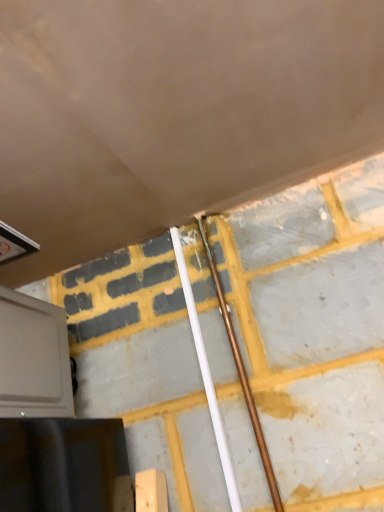
Question: Is white plastic pipe at center, the second beam when ordered from right to left, at the right side of copper metallic pipe at center, arranged as the second beam when viewed from the left?

Choices:
 (A) no
 (B) yes

Answer: (A)

Question: From a real-world perspective, is white plastic pipe at center, the 1th beam from the left, located higher than copper metallic pipe at center, arranged as the second beam when viewed from the left?

Choices:
 (A) yes
 (B) no

Answer: (A)

Question: Is white plastic pipe at center, the second beam when ordered from right to left, positioned beyond the bounds of copper metallic pipe at center, arranged as the second beam when viewed from the left?

Choices:
 (A) yes
 (B) no

Answer: (A)

Question: Does white plastic pipe at center, the second beam when ordered from right to left, appear on the left side of copper metallic pipe at center, arranged as the second beam when viewed from the left?

Choices:
 (A) no
 (B) yes

Answer: (B)

Question: Does white plastic pipe at center, the 1th beam from the left, have a lesser width compared to copper metallic pipe at center, arranged as the second beam when viewed from the left?

Choices:
 (A) no
 (B) yes

Answer: (B)

Question: Considering the positions of point (233, 343) and point (198, 356), is point (233, 343) closer or farther from the camera than point (198, 356)?

Choices:
 (A) farther
 (B) closer

Answer: (B)

Question: Is copper metallic pipe at center, arranged as the second beam when viewed from the left, inside or outside of white plastic pipe at center, the 1th beam from the left?

Choices:
 (A) inside
 (B) outside

Answer: (B)

Question: In the image, is copper metallic pipe at center, placed as the 1th beam when sorted from right to left, positioned in front of or behind white plastic pipe at center, the 1th beam from the left?

Choices:
 (A) front
 (B) behind

Answer: (A)

Question: From their relative heights in the image, would you say copper metallic pipe at center, arranged as the second beam when viewed from the left, is taller or shorter than white plastic pipe at center, the 1th beam from the left?

Choices:
 (A) tall
 (B) short

Answer: (A)

Question: Considering the positions of white plastic pipe at center, the second beam when ordered from right to left, and copper metallic pipe at center, placed as the 1th beam when sorted from right to left, in the image, is white plastic pipe at center, the second beam when ordered from right to left, taller or shorter than copper metallic pipe at center, placed as the 1th beam when sorted from right to left,?

Choices:
 (A) short
 (B) tall

Answer: (A)

Question: In terms of width, does white plastic pipe at center, the 1th beam from the left, look wider or thinner when compared to copper metallic pipe at center, arranged as the second beam when viewed from the left?

Choices:
 (A) thin
 (B) wide

Answer: (A)

Question: Which is correct: white plastic pipe at center, the second beam when ordered from right to left, is inside copper metallic pipe at center, placed as the 1th beam when sorted from right to left, or outside of it?

Choices:
 (A) outside
 (B) inside

Answer: (A)

Question: Visually, is white plastic pipe at center, the second beam when ordered from right to left, positioned to the left or to the right of copper metallic pipe at center, placed as the 1th beam when sorted from right to left?

Choices:
 (A) right
 (B) left

Answer: (B)

Question: Relative to gray matte oven at lower left, is white plastic pipe at center, the second beam when ordered from right to left, in front or behind?

Choices:
 (A) behind
 (B) front

Answer: (A)

Question: Looking at their shapes, would you say white plastic pipe at center, the second beam when ordered from right to left, is wider or thinner than gray matte oven at lower left?

Choices:
 (A) wide
 (B) thin

Answer: (B)